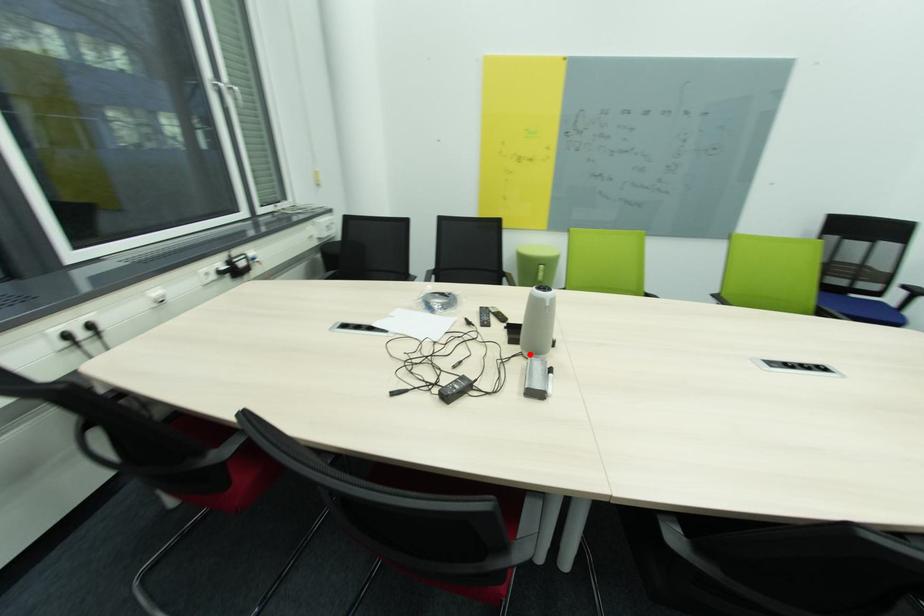
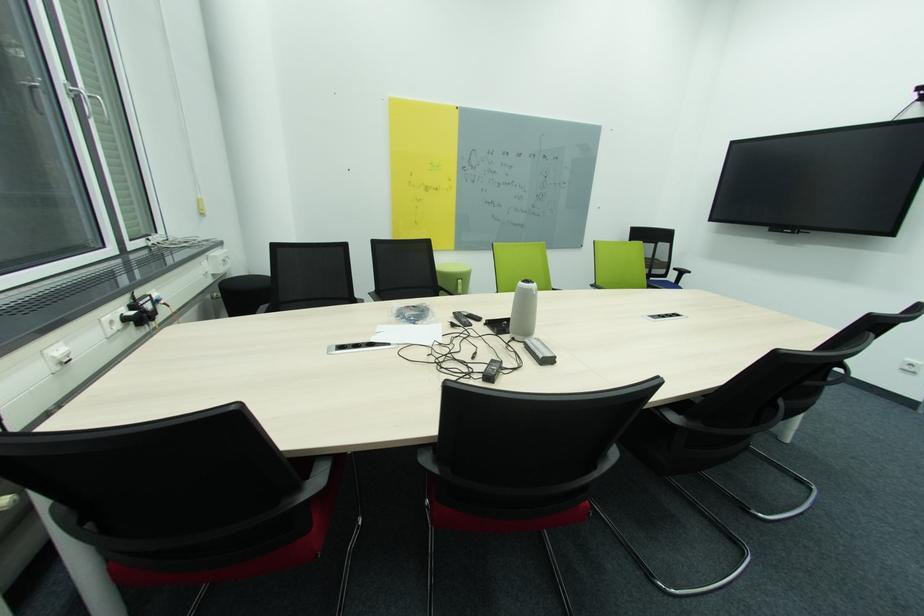
Find the pixel in the second image that matches the highlighted location in the first image.

(521, 339)